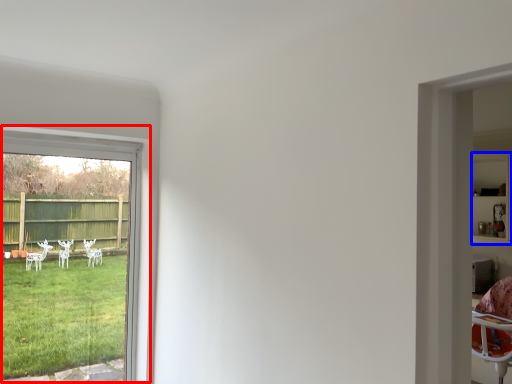
Question: Among these objects, which one is nearest to the camera, window (highlighted by a red box) or shelf (highlighted by a blue box)?

Choices:
 (A) window
 (B) shelf

Answer: (A)